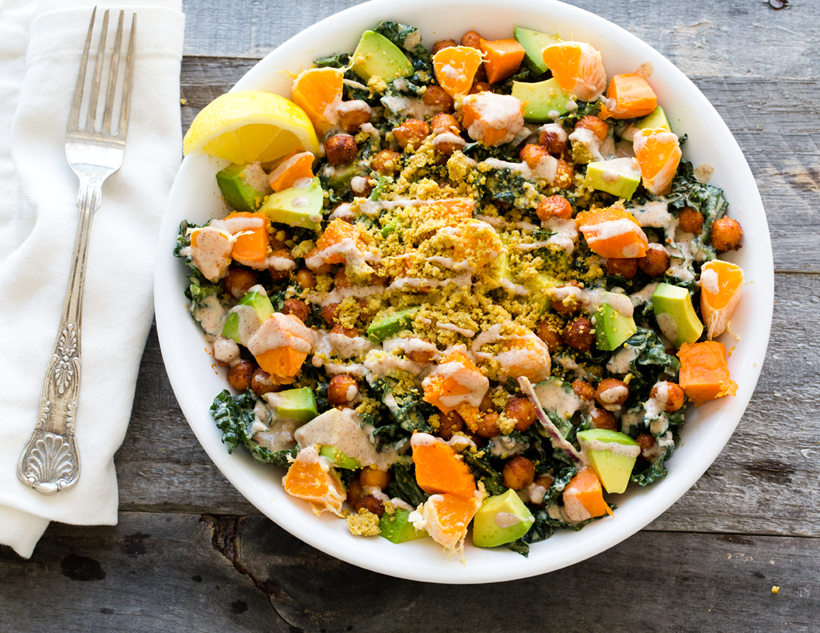
Where is `table top`? table top is located at coordinates (785, 470).